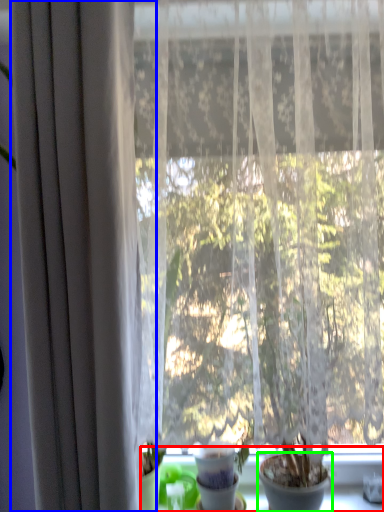
Question: Which object is positioned closest to window sill (highlighted by a red box)? Select from curtain (highlighted by a blue box) and flowerpot (highlighted by a green box).

Choices:
 (A) curtain
 (B) flowerpot

Answer: (B)